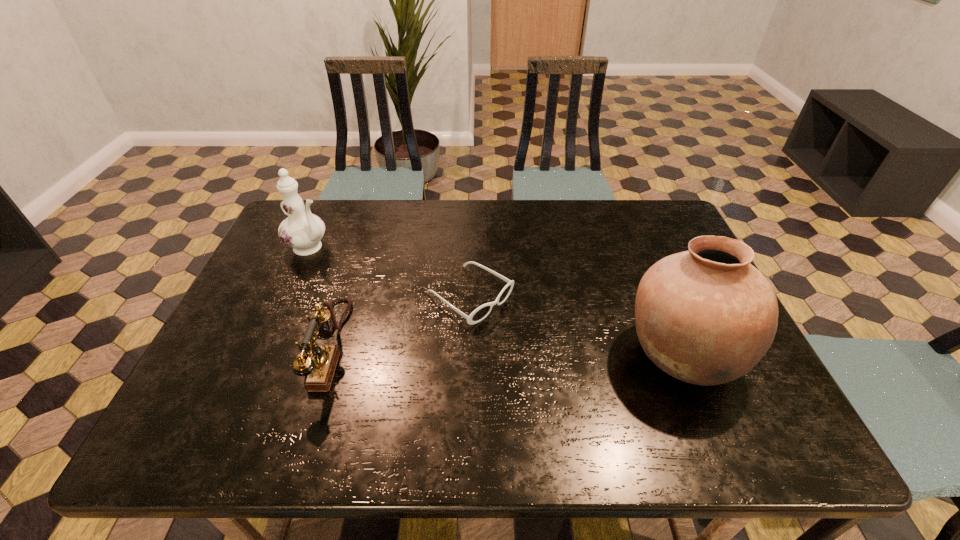
Where is `vacant region at the near right corner of the desktop`? This screenshot has width=960, height=540. vacant region at the near right corner of the desktop is located at coordinates (724, 396).

Locate an element on the screen. The height and width of the screenshot is (540, 960). unoccupied area between the pottery and the shortest object is located at coordinates (x=577, y=325).

In order to click on vacant point located between the leftmost object and the second object from right to left in this screenshot , I will do `click(390, 272)`.

You are a GUI agent. You are given a task and a screenshot of the screen. Output one action in this format:
    pyautogui.click(x=<x>, y=<y>)
    Task: Click on the free space between the second object from left to right and the farthest object
    The width and height of the screenshot is (960, 540).
    Given the screenshot: What is the action you would take?
    pyautogui.click(x=320, y=296)

The width and height of the screenshot is (960, 540). Find the location of `empty space between the third tallest object and the leftmost object`. empty space between the third tallest object and the leftmost object is located at coordinates (320, 296).

What are the coordinates of `free space between the second object from right to left and the pottery` in the screenshot? It's located at (577, 325).

This screenshot has height=540, width=960. Find the location of `vacant area that lies between the farthest object and the telephone`. vacant area that lies between the farthest object and the telephone is located at coordinates (320, 296).

Where is `empty location between the farthest object and the third object from left to right`? This screenshot has width=960, height=540. empty location between the farthest object and the third object from left to right is located at coordinates (390, 272).

Locate an element on the screen. This screenshot has height=540, width=960. free space between the chinaware and the third tallest object is located at coordinates (320, 296).

The height and width of the screenshot is (540, 960). I want to click on free space between the pottery and the third object from right to left, so click(x=506, y=350).